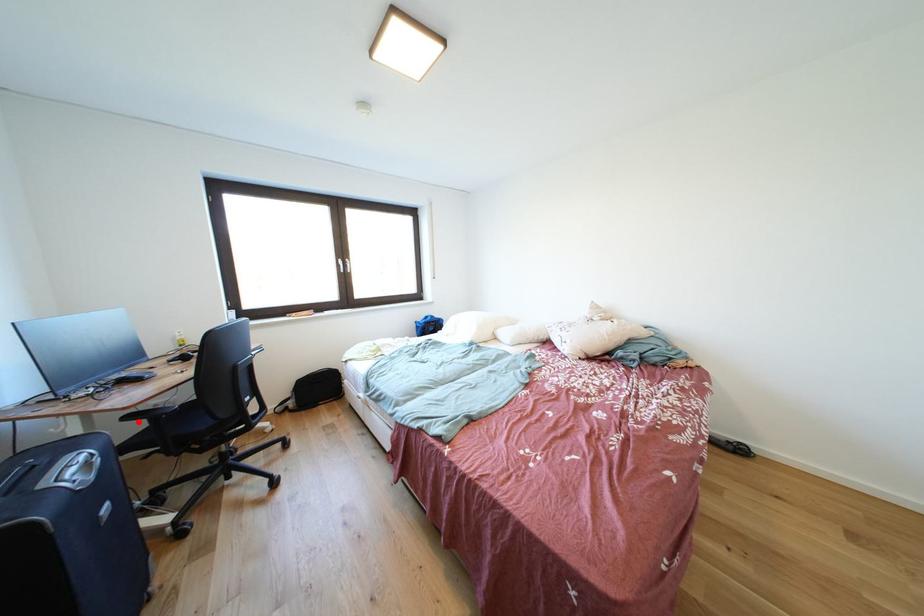
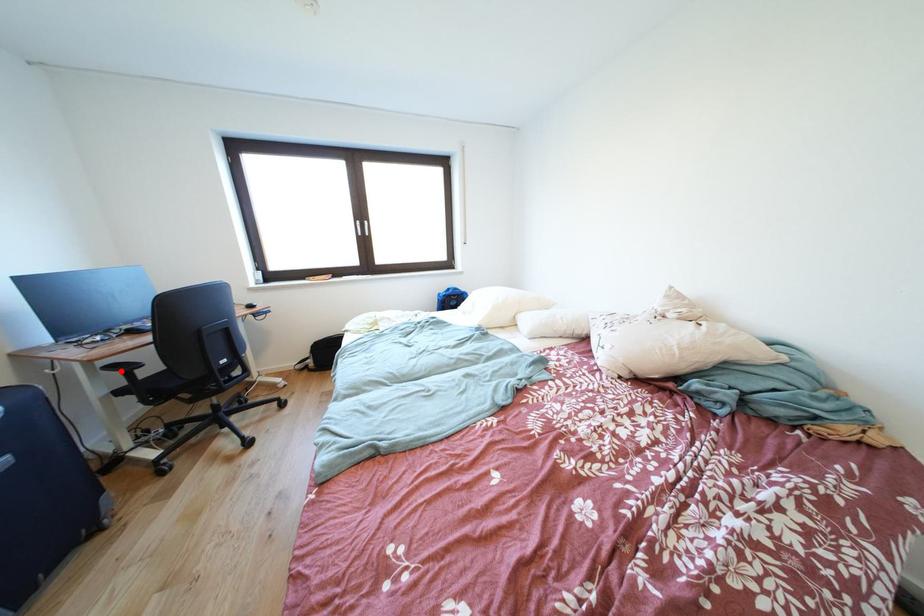
I am providing you with two images of the same scene from different viewpoints. A red point is marked on the first image and another point is marked on the second image. Is the marked point in image1 the same physical position as the marked point in image2?

Yes